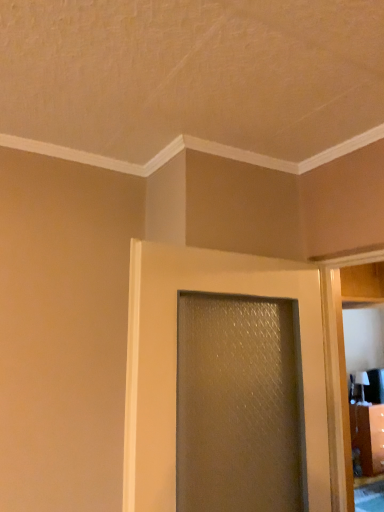
Question: Considering the positions of matte white elevator at right and satin gold textured door at center in the image, is matte white elevator at right bigger or smaller than satin gold textured door at center?

Choices:
 (A) small
 (B) big

Answer: (A)

Question: Looking at their shapes, would you say matte white elevator at right is wider or thinner than satin gold textured door at center?

Choices:
 (A) thin
 (B) wide

Answer: (A)

Question: In the image, is matte white elevator at right positioned in front of or behind satin gold textured door at center?

Choices:
 (A) front
 (B) behind

Answer: (B)

Question: Is satin gold textured door at center to the left or to the right of matte white elevator at right in the image?

Choices:
 (A) right
 (B) left

Answer: (B)

Question: From the image's perspective, relative to matte white elevator at right, is satin gold textured door at center above or below?

Choices:
 (A) below
 (B) above

Answer: (B)

Question: Based on their sizes in the image, would you say satin gold textured door at center is bigger or smaller than matte white elevator at right?

Choices:
 (A) big
 (B) small

Answer: (A)

Question: Is point (144, 413) closer or farther from the camera than point (349, 464)?

Choices:
 (A) farther
 (B) closer

Answer: (B)